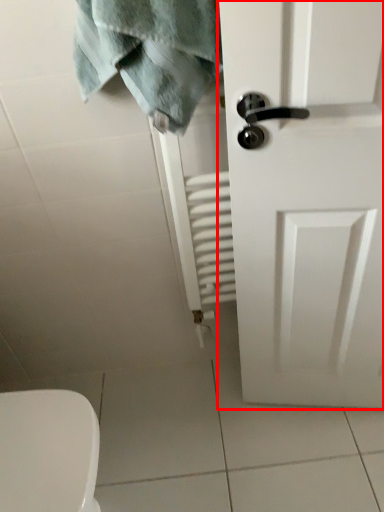
Question: From the image, what is the correct spatial relationship of door (annotated by the red box) in relation to bath towel?

Choices:
 (A) left
 (B) right

Answer: (B)